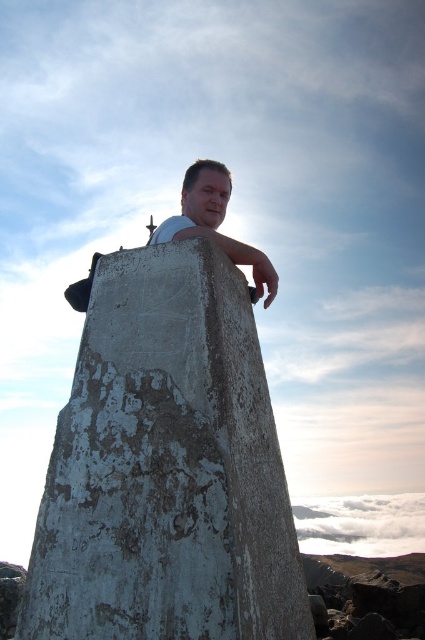
Does weathered concrete pillar at center have a greater height compared to matte concrete man at center?

Indeed, weathered concrete pillar at center has a greater height compared to matte concrete man at center.

Does weathered concrete pillar at center appear under matte concrete man at center?

Yes.

Find the location of a particular element. This screenshot has height=640, width=425. weathered concrete pillar at center is located at coordinates (166, 467).